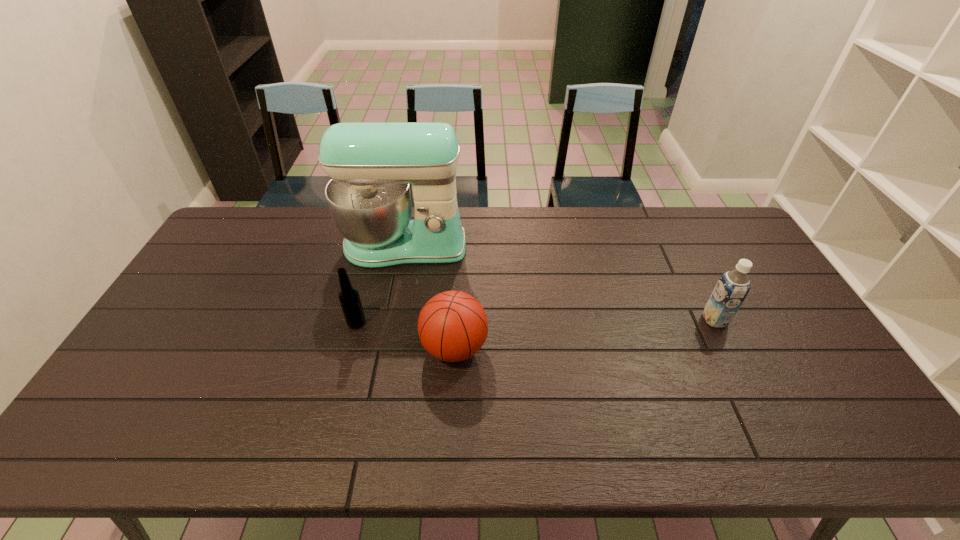
The height and width of the screenshot is (540, 960). What are the coordinates of `the farthest object` in the screenshot? It's located at (371, 165).

Identify the location of mixer. (371, 165).

The width and height of the screenshot is (960, 540). What are the coordinates of `the rightmost object` in the screenshot? It's located at (733, 286).

At what (x,y) coordinates should I click in order to perform the action: click on beer bottle. Please return your answer as a coordinate pair (x, y). This screenshot has width=960, height=540. Looking at the image, I should click on (349, 298).

Identify the location of basketball. The image size is (960, 540). (452, 326).

Locate an element on the screen. free space located at the base of the farthest object is located at coordinates (390, 321).

This screenshot has width=960, height=540. Identify the location of vacant space situated on the label of the soya milk. (625, 320).

This screenshot has width=960, height=540. I want to click on blank space located 0.360m on the label of the soya milk, so click(x=581, y=320).

Where is `vacant space situated on the label of the soya milk`? This screenshot has width=960, height=540. vacant space situated on the label of the soya milk is located at coordinates (615, 320).

Find the location of a particular element. The image size is (960, 540). vacant space located on the front of the beer bottle is located at coordinates (340, 388).